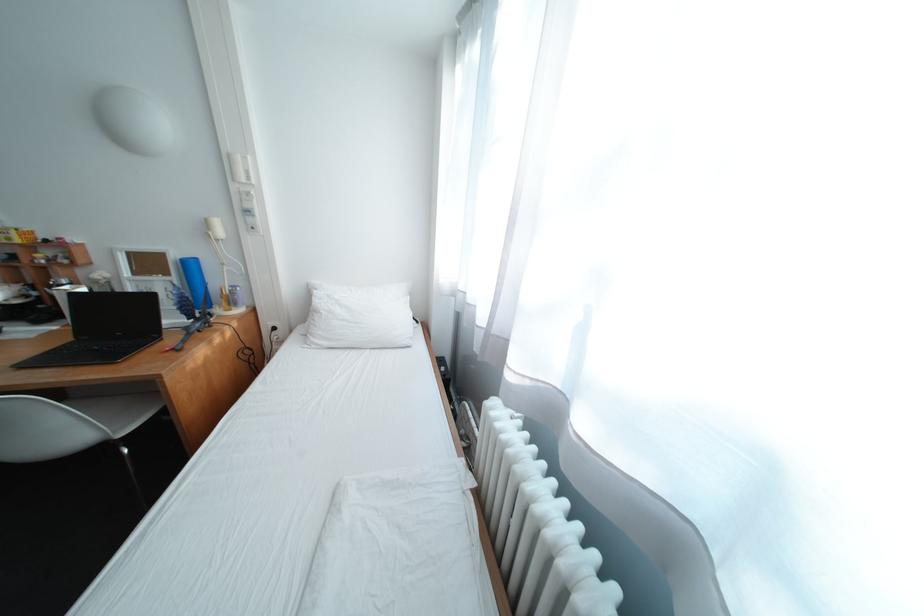
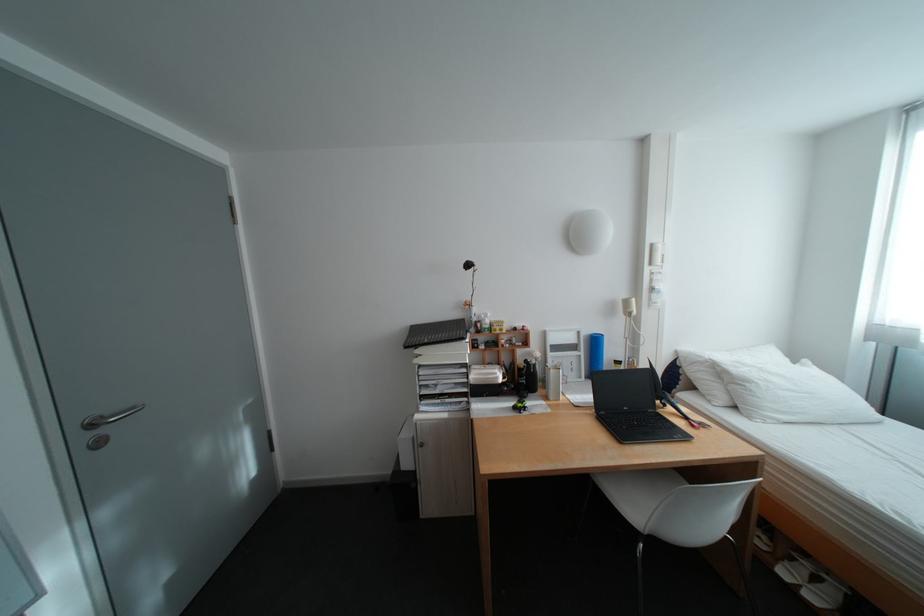
Locate, in the second image, the point that corresponds to (30,302) in the first image.

(518, 381)